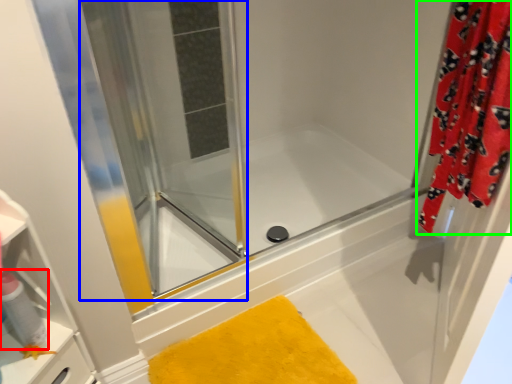
Question: Based on their relative distances, which object is farther from cleaning product (highlighted by a red box)? Choose from screen door (highlighted by a blue box) and curtain (highlighted by a green box).

Choices:
 (A) screen door
 (B) curtain

Answer: (B)